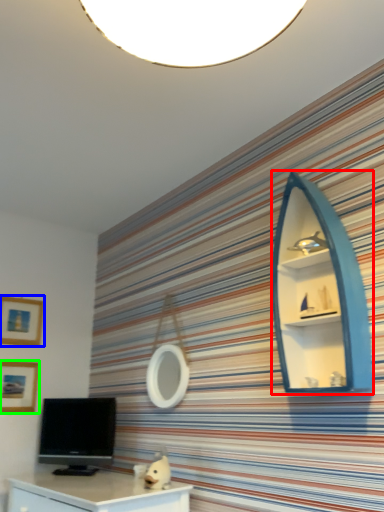
Question: Which object is the farthest from shelf (highlighted by a red box)? Choose among these: picture frame (highlighted by a blue box) or picture frame (highlighted by a green box).

Choices:
 (A) picture frame
 (B) picture frame

Answer: (B)